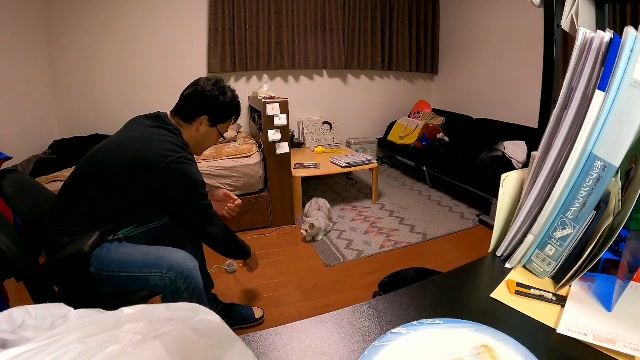
The width and height of the screenshot is (640, 360). I want to click on brown curtains, so click(x=330, y=27).